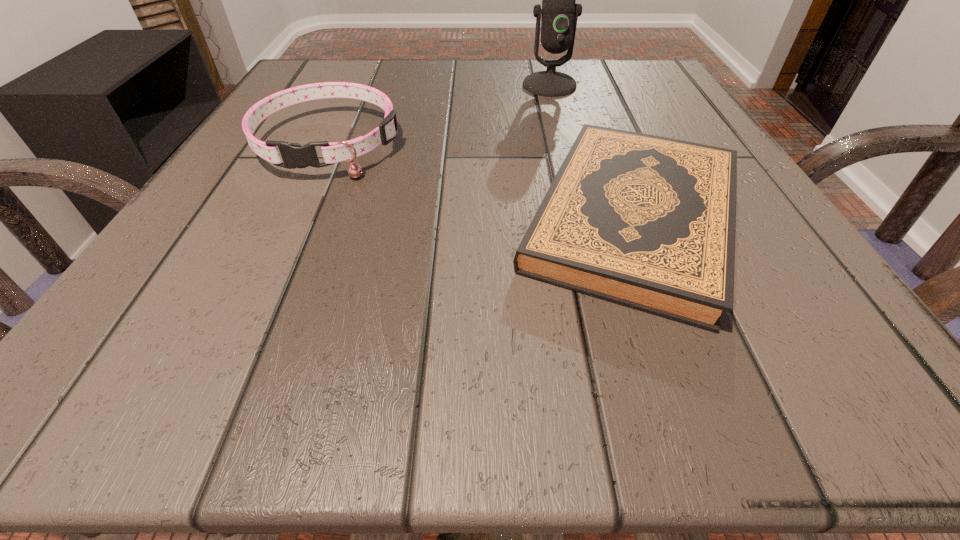
At what (x,y) coordinates should I click in order to perform the action: click on microphone. Please return your answer as a coordinate pair (x, y). The height and width of the screenshot is (540, 960). Looking at the image, I should click on (558, 22).

This screenshot has width=960, height=540. What are the coordinates of `the tallest object` in the screenshot? It's located at (558, 22).

I want to click on the second tallest object, so click(293, 155).

The image size is (960, 540). Find the location of `dog collar`. dog collar is located at coordinates pos(293,155).

Where is `the shortest object`? The width and height of the screenshot is (960, 540). the shortest object is located at coordinates (x=647, y=222).

The height and width of the screenshot is (540, 960). I want to click on free space located on the front of the microphone, so click(x=566, y=149).

This screenshot has width=960, height=540. I want to click on free location located 0.260m with the buckle on the second tallest object, so click(x=245, y=325).

Find the location of a particular element. The height and width of the screenshot is (540, 960). blank space located 0.140m on the back of the hardback book is located at coordinates (589, 106).

The image size is (960, 540). I want to click on object located at the far edge, so click(x=558, y=22).

You are a GUI agent. You are given a task and a screenshot of the screen. Output one action in this format:
    pyautogui.click(x=<x>, y=<y>)
    Task: Click on the object present at the near edge
    This screenshot has height=540, width=960.
    Given the screenshot: What is the action you would take?
    pyautogui.click(x=647, y=222)